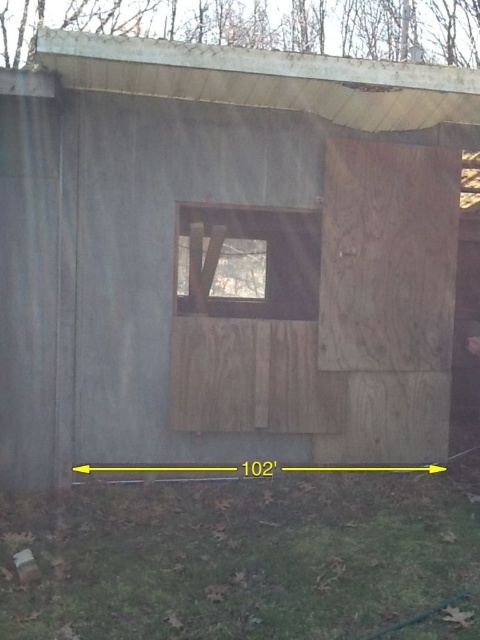
You are a contractor assessing the weathered wood hut at center and the transparent glass window at center. Which object is taller?

The weathered wood hut at center is taller than the transparent glass window at center.

You are standing in front of the weathered wood hut at center and want to look through the transparent glass window at center. Can you see the window from your current position?

The weathered wood hut at center is below the transparent glass window at center, so yes, you can see the transparent glass window at center from your current position as it is located above the hut.

You are an architect inspecting the weathered wood hut at center and the transparent glass window at center. Based on their sizes, which one would require more materials to construct?

The weathered wood hut at center is bigger than the transparent glass window at center, so it would require more materials to construct.